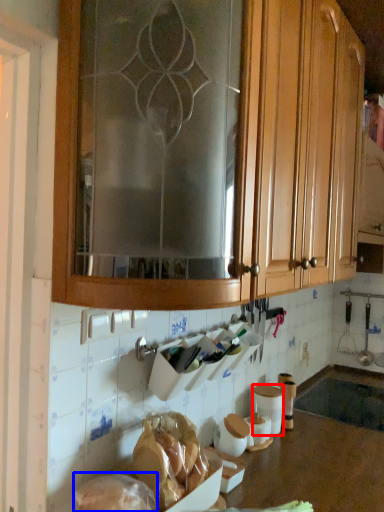
Question: Among these objects, which one is nearest to the camera, pottery (highlighted by a red box) or food (highlighted by a blue box)?

Choices:
 (A) pottery
 (B) food

Answer: (B)